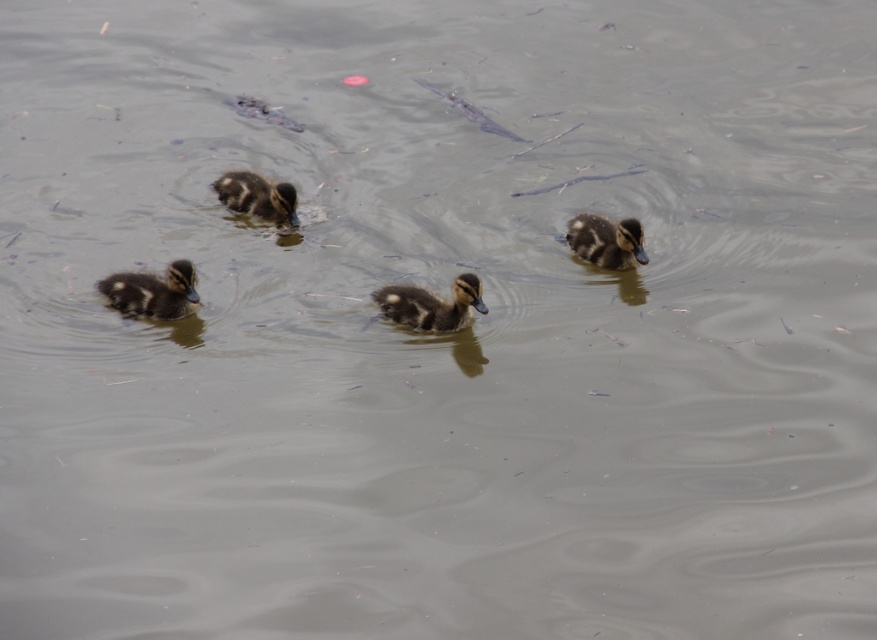
You are observing the ducklings in the water. Which duckling is positioned lower in the image, the brown fuzzy duckling at right or the brown fuzzy duckling at upper center?

The brown fuzzy duckling at right is located below the brown fuzzy duckling at upper center, so it is positioned lower in the image.

You are observing two ducklings in the water. The brown fuzzy duckling at right and the brown fuzzy duckling at upper center. Which duckling is smaller in height?

The brown fuzzy duckling at right is shorter than the brown fuzzy duckling at upper center, so the one at the right is smaller in height.

You are standing at the origin point of the coordinate system. You see two points, point (396, 304) and point (617, 262). Which point is closer to you?

Point (396, 304) is closer to you because it is in front of point (617, 262).